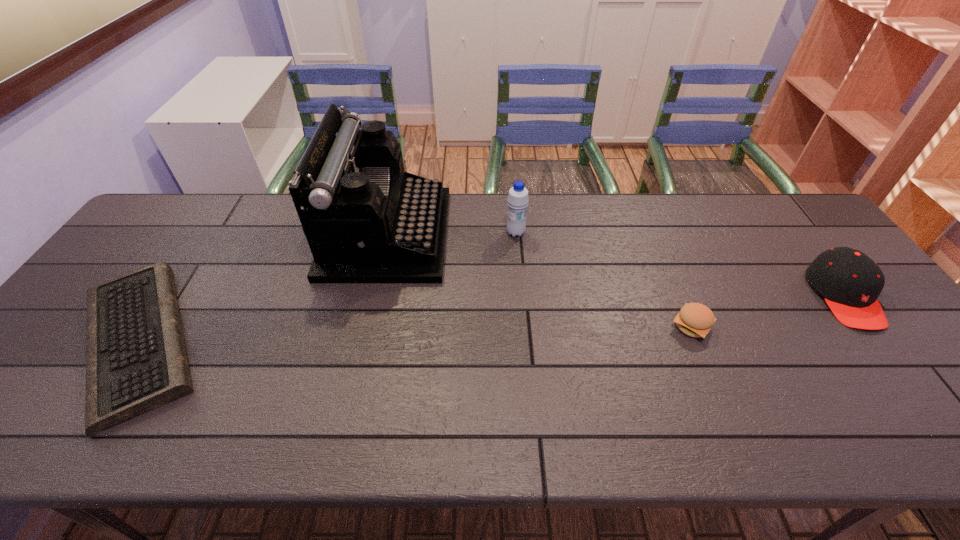
This screenshot has height=540, width=960. Identify the location of free spot between the third object from left to right and the rightmost object. (680, 265).

You are a GUI agent. You are given a task and a screenshot of the screen. Output one action in this format:
    pyautogui.click(x=<x>, y=<y>)
    Task: Click on the vacant space that's between the third tallest object and the fourth shortest object
    This screenshot has height=540, width=960.
    Given the screenshot: What is the action you would take?
    pyautogui.click(x=680, y=265)

At what (x,y) coordinates should I click in order to perform the action: click on free space between the tallest object and the fourth tallest object. Please return your answer as a coordinate pair (x, y). Looking at the image, I should click on (540, 280).

Identify the location of vacant area that lies between the fourth tallest object and the water bottle. This screenshot has height=540, width=960. (604, 280).

Identify the location of free space between the cap and the fourth object from left to right. The width and height of the screenshot is (960, 540). (768, 312).

Identify the location of object that stands as the third closest to the fourth object from right to left. The width and height of the screenshot is (960, 540). (695, 320).

Choose which object is the second nearest neighbor to the tallest object. Please provide its 2D coordinates. Your answer should be formatted as a tuple, i.e. [(x, y)], where the tuple contains the x and y coordinates of a point satisfying the conditions above.

[(517, 200)]

Locate an element on the screen. The image size is (960, 540). vacant region that satisfies the following two spatial constraints: 1. on the typing side of the tallest object; 2. on the right side of the second shortest object is located at coordinates click(x=366, y=327).